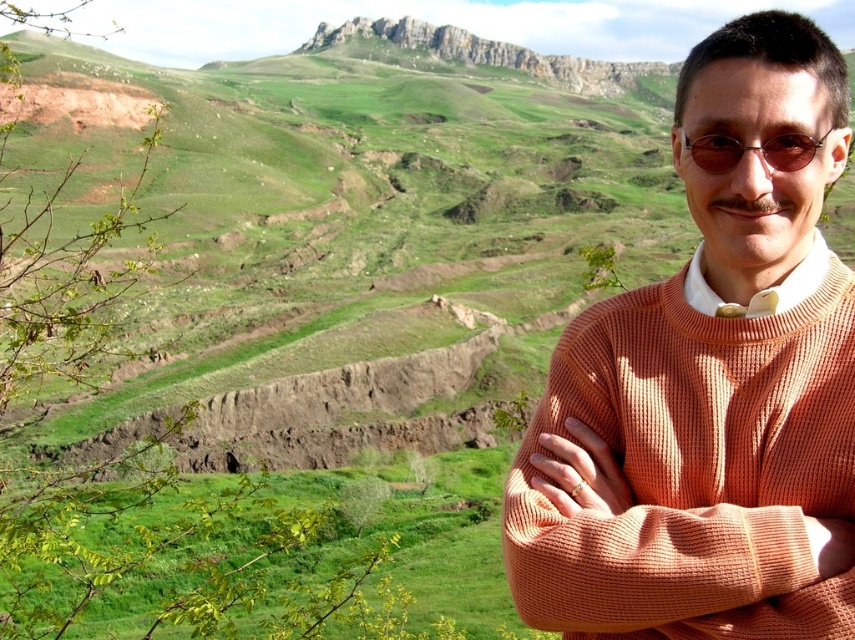
You are a photographer trying to capture the orange waffle knit sweater at right in your shot. The camera you are using has a rectangular viewfinder with coordinates from 0 to 1 on both the x and y axes. The sweater is located at point (708,392). You want to ensure that the sweater is centered in the viewfinder. What adjustments should you make to the camera position to center the sweater?

To center the orange waffle knit sweater at right located at point (708,392), you should adjust the camera so that the sweater is positioned at the center coordinates of the viewfinder, which are 0.5, 0.5. This means moving the camera to the left by 0.113 units on the x axis and downward by 0.329 units on the y axis to ensure the sweater is centered.